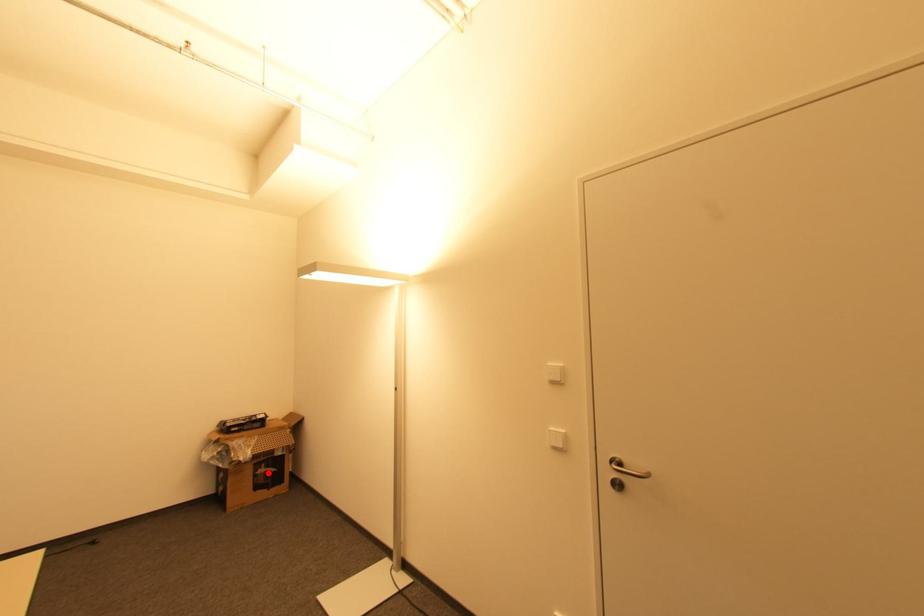
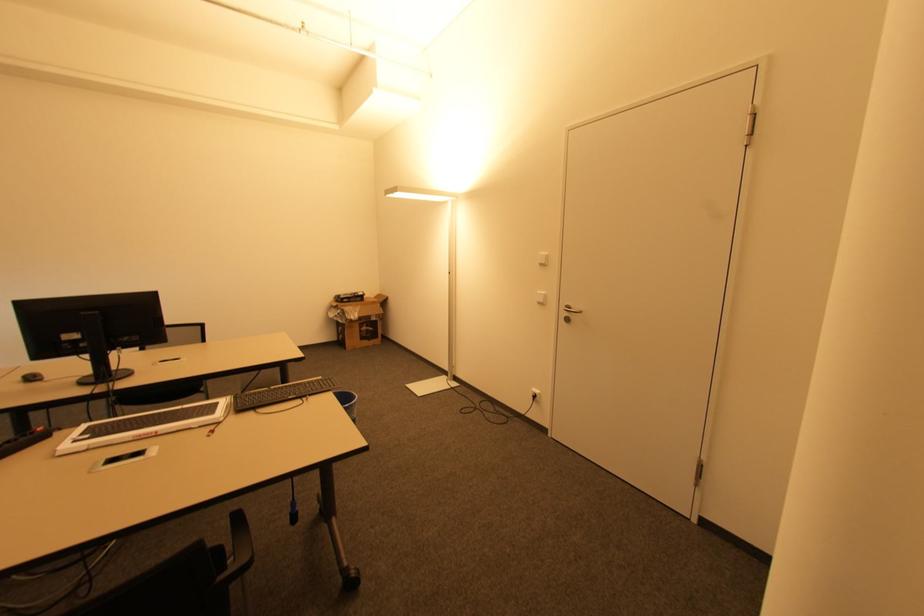
Find the pixel in the second image that matches the highlighted location in the first image.

(369, 331)